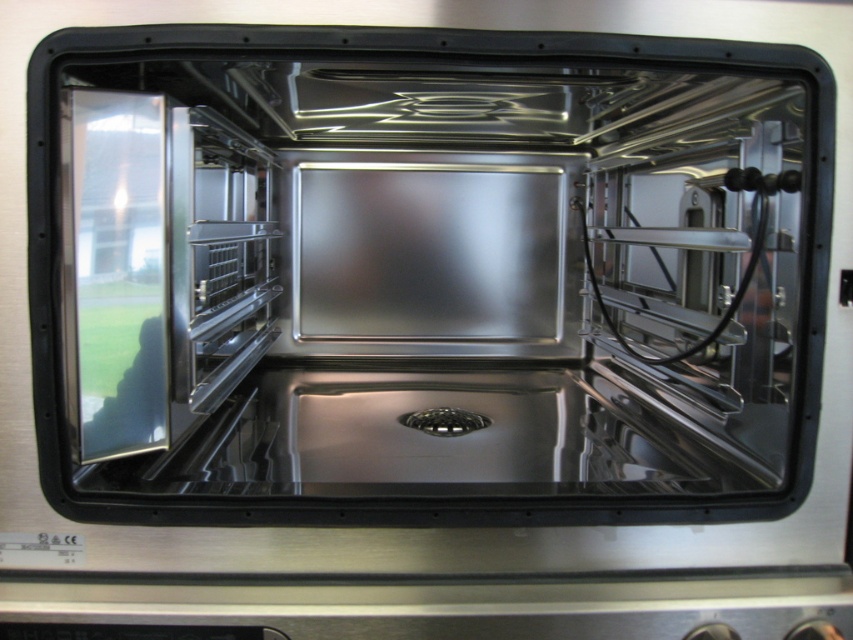
Based on the photo, can you confirm if stainless steel oven at center is positioned below transparent glass door at left?

No, stainless steel oven at center is not below transparent glass door at left.

Is the position of stainless steel oven at center less distant than that of transparent glass door at left?

Yes, stainless steel oven at center is closer to the viewer.

The image size is (853, 640). Describe the element at coordinates (462, 280) in the screenshot. I see `stainless steel oven at center` at that location.

Where is `stainless steel oven at center`? stainless steel oven at center is located at coordinates (462, 280).

Does transparent glass door at left have a greater height compared to polished stainless steel exhaust hood at center?

Yes.

Is transparent glass door at left positioned behind polished stainless steel exhaust hood at center?

That is True.

Between point (120, 378) and point (630, 92), which one is positioned behind?

Positioned behind is point (630, 92).

Locate an element on the screen. The image size is (853, 640). transparent glass door at left is located at coordinates point(117,269).

Does stainless steel oven at center appear on the right side of polished stainless steel exhaust hood at center?

No, stainless steel oven at center is not to the right of polished stainless steel exhaust hood at center.

Is point (206, 381) in front of point (537, 129)?

Yes, point (206, 381) is closer to viewer.

Which is in front, point (149, 464) or point (386, 99)?

Point (149, 464)

Locate an element on the screen. stainless steel oven at center is located at coordinates (462, 280).